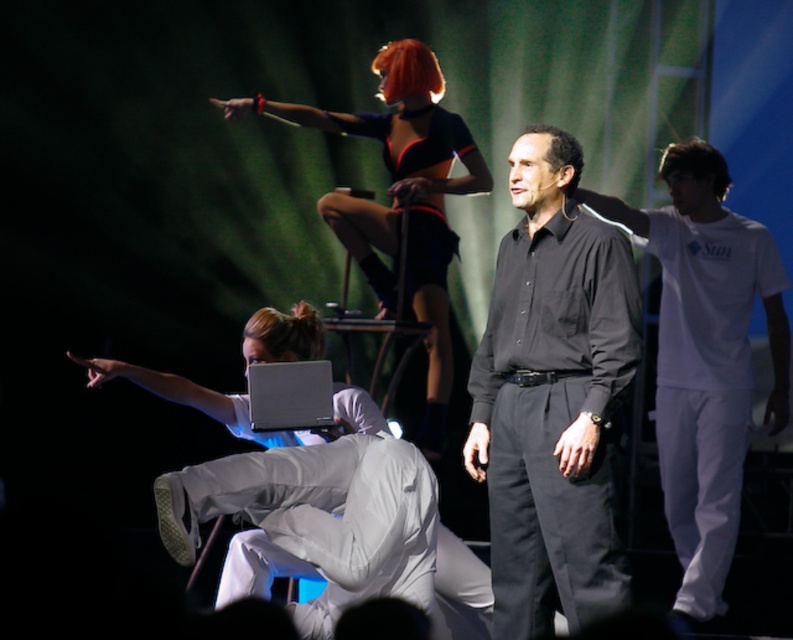
Question: Observing the image, what is the correct spatial positioning of black smooth shirt at center in reference to shiny black dress at upper center?

Choices:
 (A) above
 (B) below

Answer: (B)

Question: Which object is closer to the camera taking this photo?

Choices:
 (A) black smooth shirt at center
 (B) white cotton t-shirt at right
 (C) white matte laptop at center
 (D) shiny black dress at upper center

Answer: (A)

Question: Considering the real-world distances, which object is closest to the shiny black dress at upper center?

Choices:
 (A) black smooth shirt at center
 (B) white matte laptop at center
 (C) white cotton t-shirt at right

Answer: (C)

Question: Is shiny black dress at upper center thinner than white matte laptop at center?

Choices:
 (A) yes
 (B) no

Answer: (B)

Question: Is black smooth shirt at center smaller than white matte laptop at center?

Choices:
 (A) yes
 (B) no

Answer: (B)

Question: Which point is farther to the camera?

Choices:
 (A) black smooth shirt at center
 (B) shiny black dress at upper center
 (C) white matte laptop at center

Answer: (B)